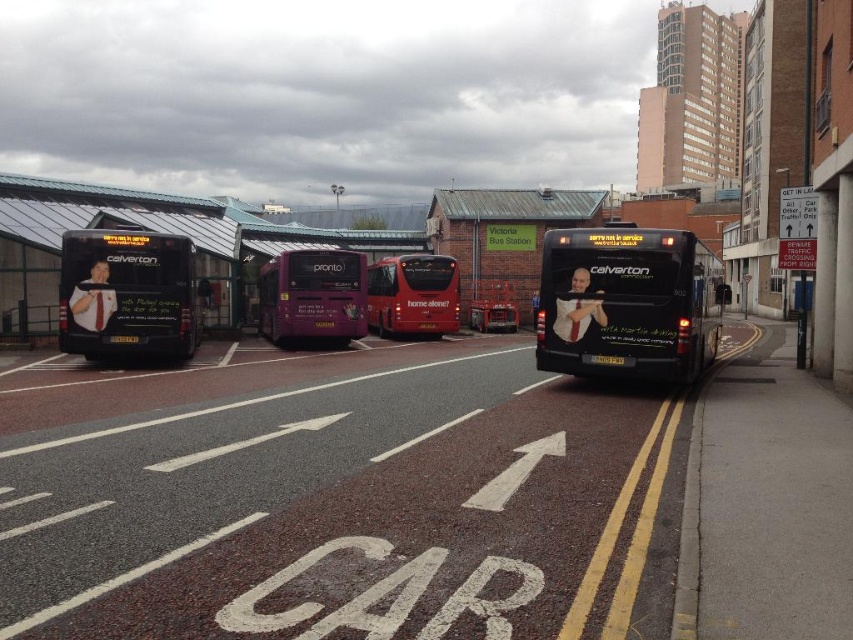
Is point (265, 269) behind point (412, 324)?

No.

Between point (296, 312) and point (381, 280), which one is positioned in front?

Point (296, 312) is in front.

Who is more distant from viewer, (x=322, y=260) or (x=392, y=289)?

Positioned behind is point (x=392, y=289).

Locate an element on the screen. Image resolution: width=853 pixels, height=640 pixels. purple glossy bus at center is located at coordinates (312, 296).

In the scene shown: Does black matte bus at right appear under black plastic license plate at center?

Incorrect, black matte bus at right is not positioned below black plastic license plate at center.

Can you confirm if black matte bus at right is thinner than black plastic license plate at center?

No.

Between point (584, 339) and point (120, 339), which one is positioned behind?

Point (120, 339)

This screenshot has width=853, height=640. What are the coordinates of `black matte bus at right` in the screenshot? It's located at (628, 301).

Between red matte bus at center and black plastic license plate at rear, which one has less height?

black plastic license plate at rear

Between red matte bus at center and black plastic license plate at rear, which one is positioned lower?

black plastic license plate at rear

Locate an element on the screen. Image resolution: width=853 pixels, height=640 pixels. red matte bus at center is located at coordinates (413, 296).